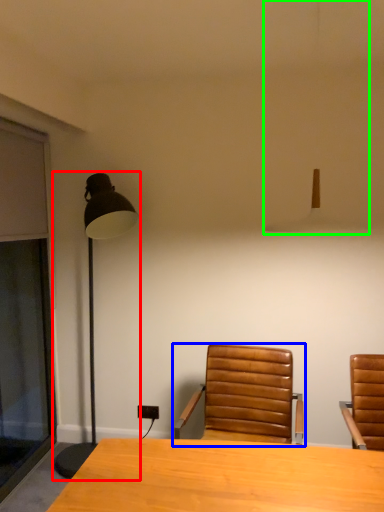
Question: Estimate the real-world distances between objects in this image. Which object is closer to lamp (highlighted by a red box), chair (highlighted by a blue box) or lamp (highlighted by a green box)?

Choices:
 (A) chair
 (B) lamp

Answer: (B)